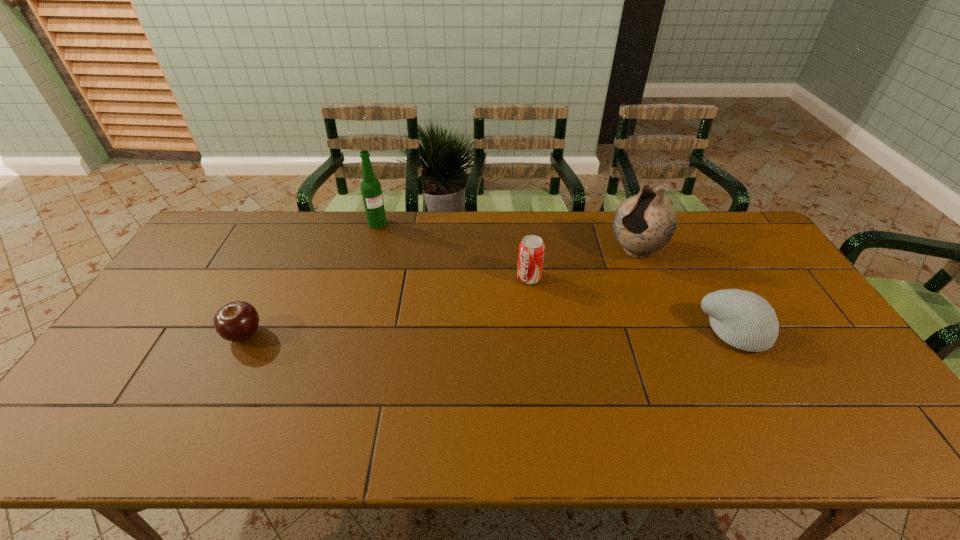
The image size is (960, 540). In order to click on object situated at the right edge in this screenshot , I will do `click(743, 319)`.

You are a GUI agent. You are given a task and a screenshot of the screen. Output one action in this format:
    pyautogui.click(x=<x>, y=<y>)
    Task: Click on the free space at the far edge of the desktop
    
    Given the screenshot: What is the action you would take?
    pyautogui.click(x=474, y=253)

This screenshot has height=540, width=960. I want to click on free space at the near edge of the desktop, so tap(694, 407).

Locate an element on the screen. This screenshot has width=960, height=540. free location at the right edge is located at coordinates (812, 352).

I want to click on vacant space at the far left corner of the desktop, so click(216, 232).

The height and width of the screenshot is (540, 960). What are the coordinates of `vacant space at the near left corner of the desktop` in the screenshot? It's located at coord(132,379).

Where is `vacant area at the far right corner`? The width and height of the screenshot is (960, 540). vacant area at the far right corner is located at coordinates (746, 245).

This screenshot has height=540, width=960. In order to click on unoccupied area between the beanie and the third nearest object in this screenshot , I will do `click(632, 305)`.

Where is `free space between the beanie and the pottery`? free space between the beanie and the pottery is located at coordinates (685, 291).

What are the coordinates of `free spot between the second object from left to right and the pottery` in the screenshot? It's located at (507, 237).